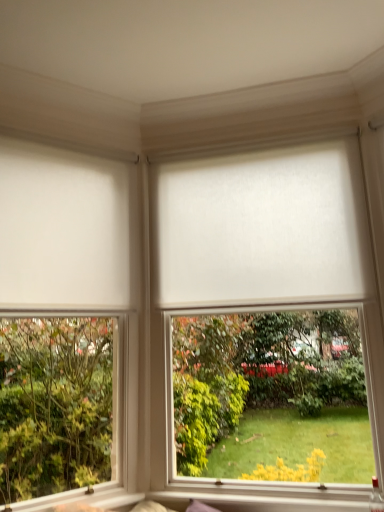
Question: From the image's perspective, relative to white matte blind at left, the first blind viewed from the left, is white matte roller blind at center, positioned as the 2th window in left-to-right order, above or below?

Choices:
 (A) above
 (B) below

Answer: (B)

Question: From a real-world perspective, relative to white matte blind at left, the first blind viewed from the left, is white matte roller blind at center, positioned as the 2th window in left-to-right order, vertically above or below?

Choices:
 (A) below
 (B) above

Answer: (A)

Question: Which object is the closest to the white matte blind at center, the 1th blind from the right?

Choices:
 (A) white matte blind at left, positioned as the 2th blind in right-to-left order
 (B) white matte roller blind at left, the second window positioned from the right
 (C) white matte roller blind at center, positioned as the 1th window in right-to-left order

Answer: (C)

Question: Estimate the real-world distances between objects in this image. Which object is farther from the white matte roller blind at center, positioned as the 1th window in right-to-left order?

Choices:
 (A) white matte blind at center, arranged as the second blind when viewed from the left
 (B) white matte roller blind at left, which ranks as the 1th window in left-to-right order
 (C) white matte blind at left, the first blind viewed from the left

Answer: (B)